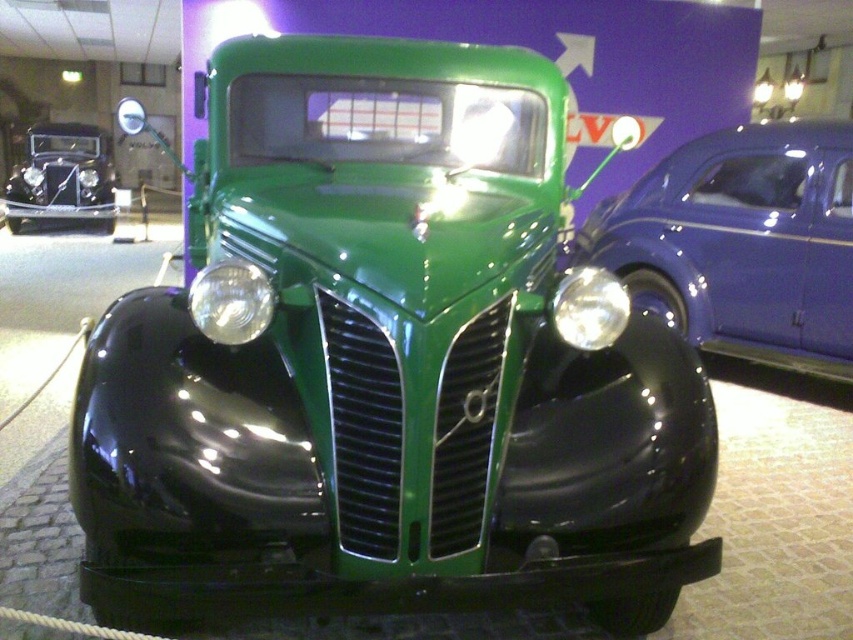
Question: Does matte black headlight at center appear on the right side of clear glass headlight at center?

Choices:
 (A) yes
 (B) no

Answer: (B)

Question: Which object is closer to the camera taking this photo?

Choices:
 (A) shiny black car at left
 (B) metallic blue car at right
 (C) clear glass headlight at center
 (D) matte black headlight at center

Answer: (D)

Question: Can you confirm if green shiny pickup truck at center is wider than shiny black car at left?

Choices:
 (A) no
 (B) yes

Answer: (B)

Question: Among these objects, which one is farthest from the camera?

Choices:
 (A) green shiny pickup truck at center
 (B) clear glass headlight at center
 (C) metallic blue car at right
 (D) matte black headlight at center

Answer: (C)

Question: Can you confirm if matte black headlight at center is positioned above clear glass headlight at center?

Choices:
 (A) yes
 (B) no

Answer: (A)

Question: Which point is closer to the camera?

Choices:
 (A) matte black headlight at center
 (B) clear glass headlight at center

Answer: (A)